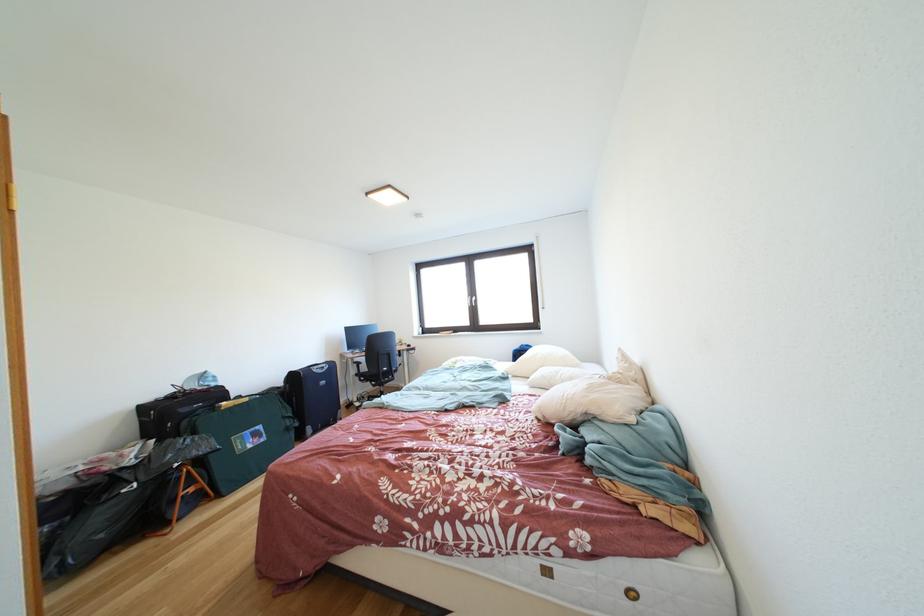
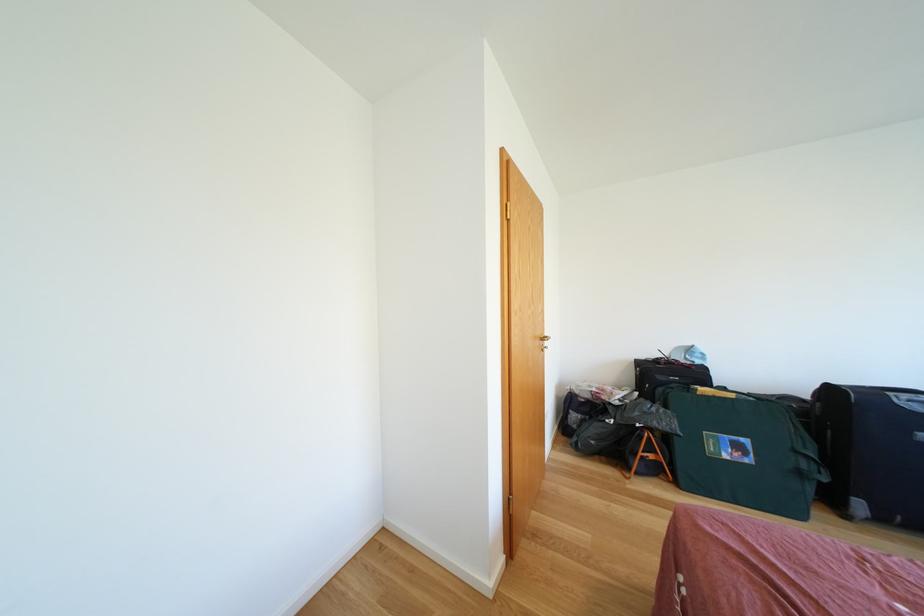
In the second image, find the point that corresponds to pixel 254 403 in the first image.

(739, 400)